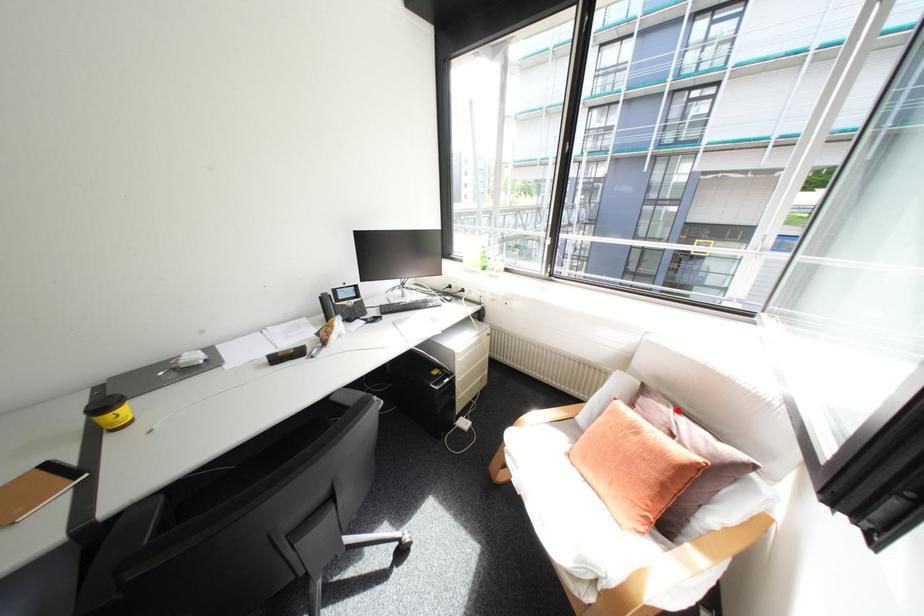
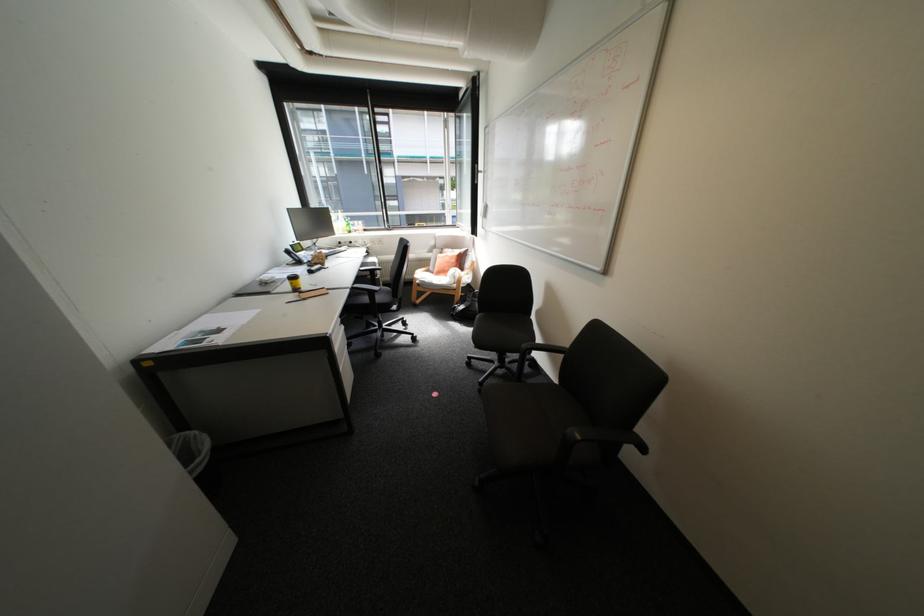
Locate, in the second image, the point that corresponds to the highlighted location in the first image.

(459, 249)